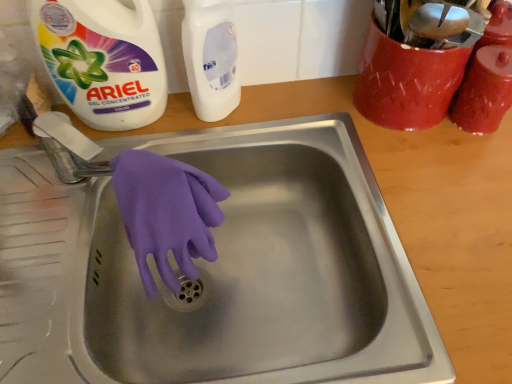
Where is `free space in front of white gel concentrated at upper left, which ranks as the 1th cleaning product in left-to-right order`? The width and height of the screenshot is (512, 384). free space in front of white gel concentrated at upper left, which ranks as the 1th cleaning product in left-to-right order is located at coordinates pyautogui.click(x=80, y=198).